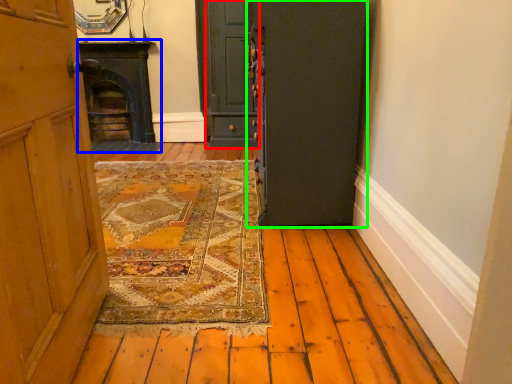
Question: Considering the real-world distances, which object is closest to door (highlighted by a red box)? fireplace (highlighted by a blue box) or door (highlighted by a green box).

Choices:
 (A) fireplace
 (B) door

Answer: (A)